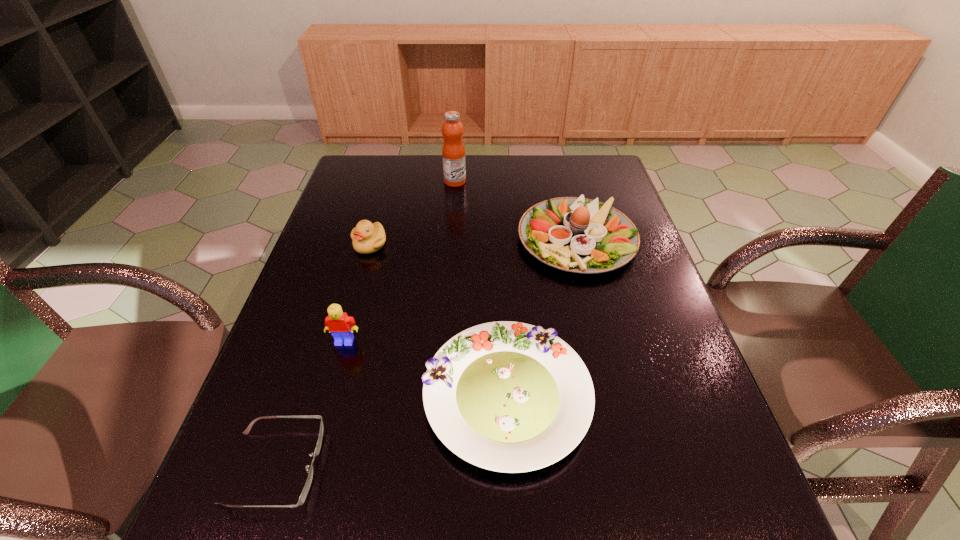
In order to click on object that is at the near left corner in this screenshot , I will do `click(306, 488)`.

The width and height of the screenshot is (960, 540). What are the coordinates of `vacant region at the far edge` in the screenshot? It's located at (474, 183).

I want to click on vacant space at the near edge of the desktop, so (405, 510).

Where is `vacant space at the left edge of the desktop`? vacant space at the left edge of the desktop is located at coordinates (325, 248).

At what (x,y) coordinates should I click in order to perform the action: click on vacant point at the right edge. Please return your answer as a coordinate pair (x, y). Looking at the image, I should click on (662, 368).

Locate an element on the screen. free location at the far left corner of the desktop is located at coordinates (372, 184).

Identify the location of vacant area between the fruit juice and the third shortest object. click(413, 213).

Find the location of a particular element. Image resolution: width=960 pixels, height=540 pixels. blank region between the shorter salad plate and the taller salad plate is located at coordinates (541, 318).

Where is `free space between the spectacles and the duckling`? free space between the spectacles and the duckling is located at coordinates (323, 355).

The image size is (960, 540). I want to click on free space between the shortest object and the third shortest object, so click(323, 355).